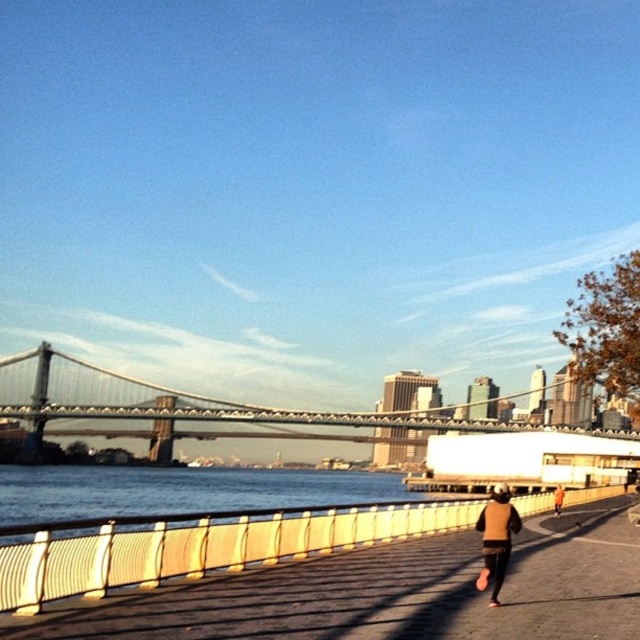
Question: Can you confirm if wooden boardwalk at center is positioned to the right of orange fabric jacket at lower right?

Choices:
 (A) no
 (B) yes

Answer: (A)

Question: Among these objects, which one is nearest to the camera?

Choices:
 (A) wooden boardwalk at center
 (B) metallic gray suspension bridge at center
 (C) orange fabric jacket at lower right

Answer: (A)

Question: From the image, what is the correct spatial relationship of brown suede jacket at lower right in relation to orange fabric jacket at lower right?

Choices:
 (A) below
 (B) above

Answer: (B)

Question: Among these points, which one is nearest to the camera?

Choices:
 (A) (496, 512)
 (B) (160, 602)
 (C) (557, 513)

Answer: (B)

Question: Among these objects, which one is nearest to the camera?

Choices:
 (A) metallic gray suspension bridge at center
 (B) orange fabric jacket at lower right

Answer: (B)

Question: Considering the relative positions of wooden boardwalk at center and metallic gray suspension bridge at center in the image provided, where is wooden boardwalk at center located with respect to metallic gray suspension bridge at center?

Choices:
 (A) above
 (B) below

Answer: (A)